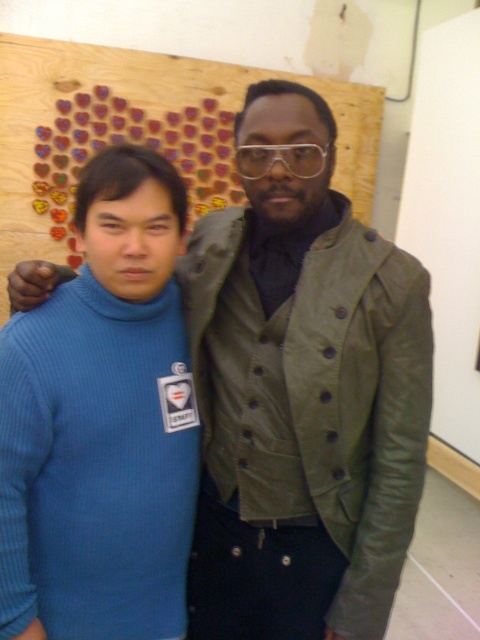
You are an event organizer who needs to determine the correct order of participants based on their clothing. Given that the matte green leather vest at center is taller than the blue ribbed sweater at left, which clothing item should be placed higher in the lineup?

The matte green leather vest at center should be placed higher in the lineup since it has a greater height compared to the blue ribbed sweater at left.

You are a costume designer preparing for a play and need to determine which garment has a wider silhouette between the matte green leather vest at center and the blue ribbed sweater at left. Based on the scene description, which one should you choose?

The matte green leather vest at center has a wider silhouette than the blue ribbed sweater at left, so you should choose the matte green leather vest at center for a wider silhouette.

You are organizing a costume party and need to decide which outfit to wear. You have the matte green leather vest at center and the blue ribbed sweater at left. Based on their sizes, which one would you choose if you want something more spacious?

The matte green leather vest at center is bigger than the blue ribbed sweater at left, so you should choose the matte green leather vest at center for a more spacious fit.